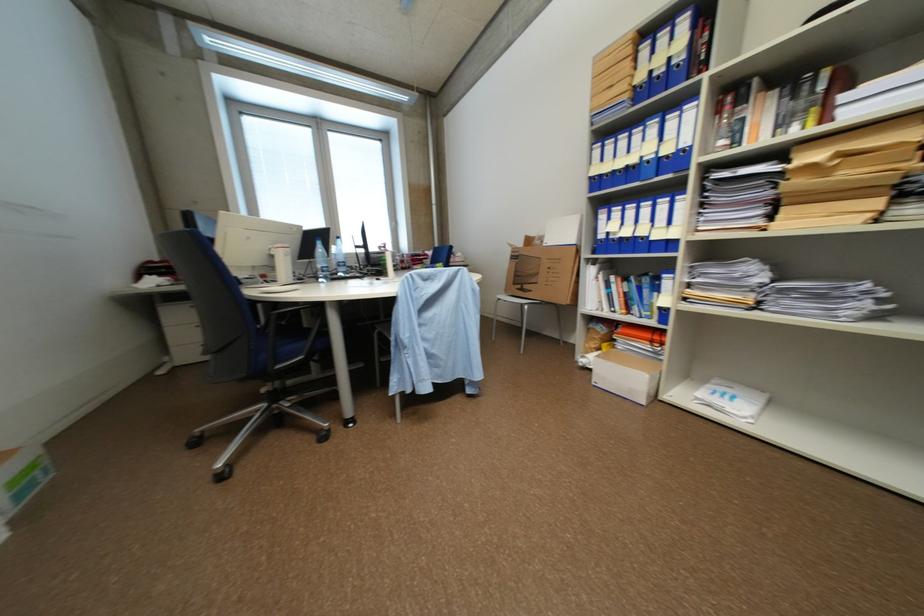
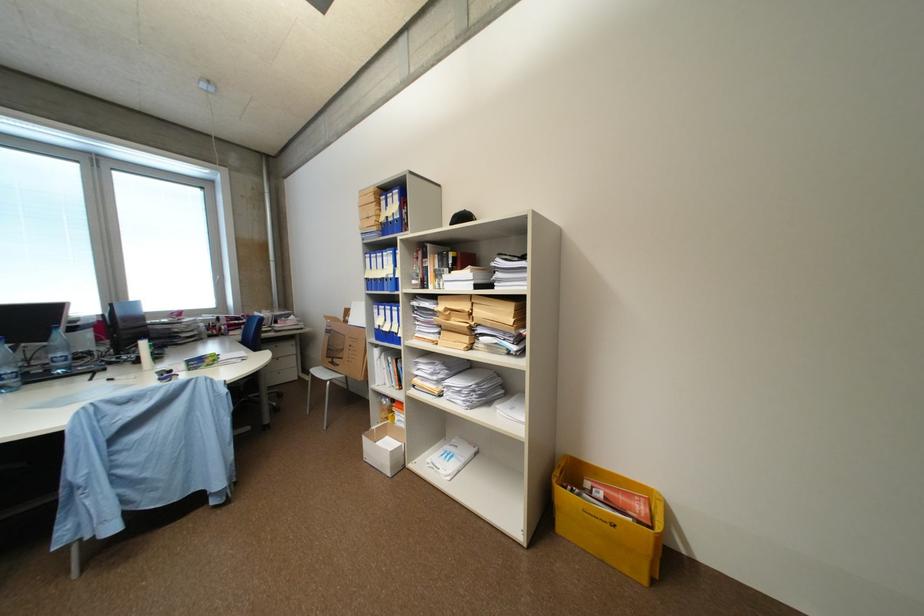
Find the pixel in the second image that matches pixel 333 277 in the first image.

(10, 389)